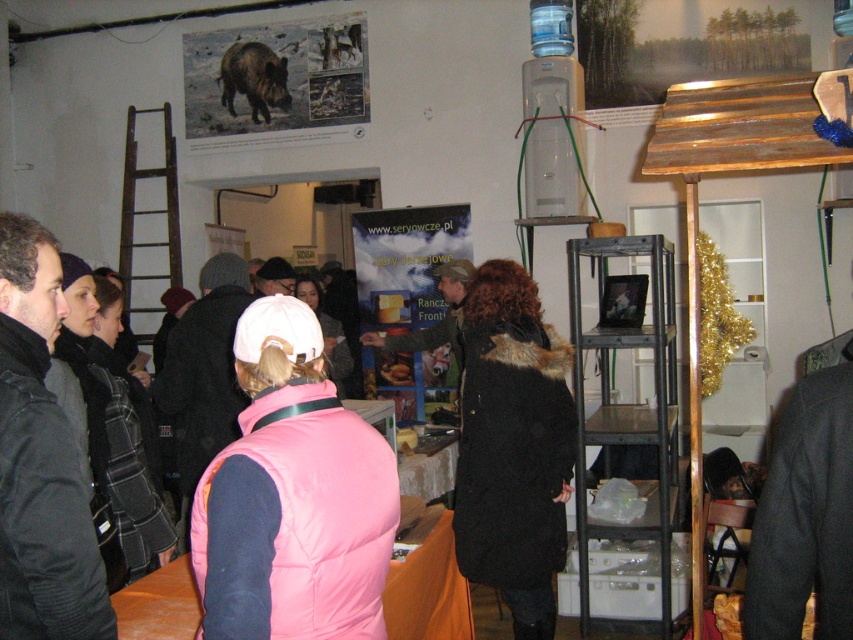
Question: Which of the following is the farthest from the observer?

Choices:
 (A) black woolen jacket at left
 (B) brown furry wild boar at upper left
 (C) pink puffy vest at center

Answer: (B)

Question: Which of the following is the closest to the observer?

Choices:
 (A) brown furry wild boar at upper left
 (B) pink puffy vest at center

Answer: (B)

Question: Among these objects, which one is farthest from the camera?

Choices:
 (A) black woolen jacket at left
 (B) pink puffy vest at center

Answer: (A)

Question: Is pink puffy vest at center bigger than brown furry wild boar at upper left?

Choices:
 (A) yes
 (B) no

Answer: (A)

Question: Is black woolen jacket at left further to the viewer compared to brown furry wild boar at upper left?

Choices:
 (A) no
 (B) yes

Answer: (A)

Question: Can you confirm if pink puffy vest at center is positioned below brown furry wild boar at upper left?

Choices:
 (A) yes
 (B) no

Answer: (A)